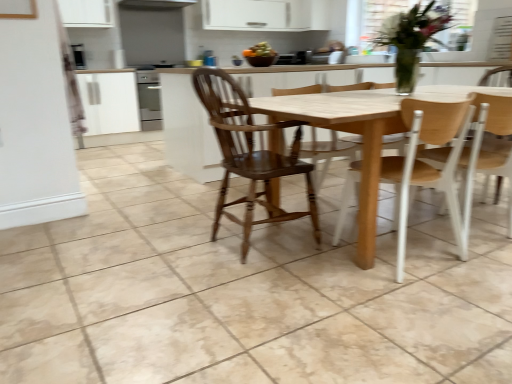
Question: Is smooth orange fruit bowl at upper center outside wooden chair at center, which appears as the 3th chair when viewed from the right?

Choices:
 (A) no
 (B) yes

Answer: (B)

Question: Is smooth orange fruit bowl at upper center with wooden chair at center, acting as the first chair starting from the left?

Choices:
 (A) no
 (B) yes

Answer: (A)

Question: Does smooth orange fruit bowl at upper center have a larger size compared to wooden chair at center, which appears as the 3th chair when viewed from the right?

Choices:
 (A) yes
 (B) no

Answer: (B)

Question: From a real-world perspective, does smooth orange fruit bowl at upper center sit lower than wooden chair at center, which appears as the 3th chair when viewed from the right?

Choices:
 (A) yes
 (B) no

Answer: (B)

Question: From the image's perspective, is smooth orange fruit bowl at upper center beneath wooden chair at center, acting as the first chair starting from the left?

Choices:
 (A) yes
 (B) no

Answer: (B)

Question: Is smooth orange fruit bowl at upper center at the left side of wooden chair at center, which appears as the 3th chair when viewed from the right?

Choices:
 (A) yes
 (B) no

Answer: (B)

Question: From a real-world perspective, does smooth orange fruit bowl at upper center sit lower than light brown wood chair at right, which is counted as the first chair, starting from the right?

Choices:
 (A) no
 (B) yes

Answer: (A)

Question: Is smooth orange fruit bowl at upper center wider than light brown wood chair at right, which appears as the third chair when viewed from the left?

Choices:
 (A) no
 (B) yes

Answer: (A)

Question: Could you tell me if smooth orange fruit bowl at upper center is facing light brown wood chair at right, which is counted as the first chair, starting from the right?

Choices:
 (A) yes
 (B) no

Answer: (B)

Question: Is smooth orange fruit bowl at upper center to the right of light brown wood chair at right, which is counted as the first chair, starting from the right, from the viewer's perspective?

Choices:
 (A) yes
 (B) no

Answer: (B)

Question: Is smooth orange fruit bowl at upper center shorter than light brown wood chair at right, which appears as the third chair when viewed from the left?

Choices:
 (A) no
 (B) yes

Answer: (B)

Question: From the image's perspective, does smooth orange fruit bowl at upper center appear higher than light brown wood chair at right, which appears as the third chair when viewed from the left?

Choices:
 (A) no
 (B) yes

Answer: (B)

Question: Is light brown wood chair at right, which is counted as the first chair, starting from the right, at the right side of wooden chair at center, acting as the first chair starting from the left?

Choices:
 (A) yes
 (B) no

Answer: (A)